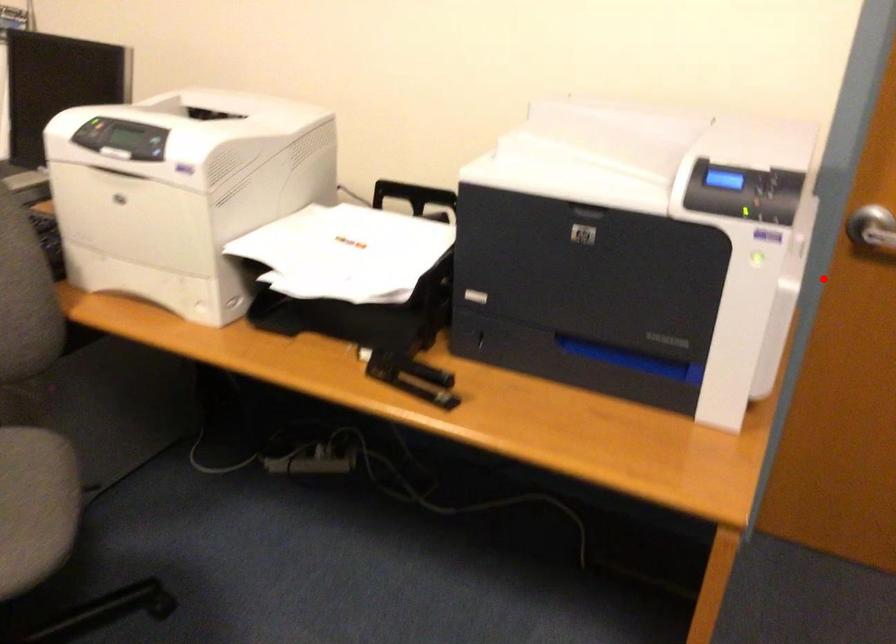
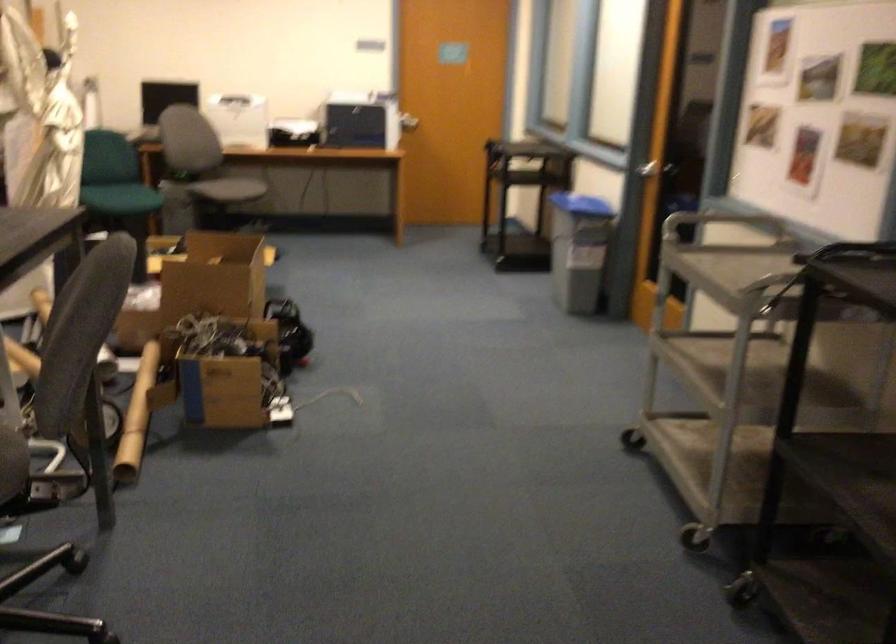
Question: A red point is marked in image1. In image2, is the corresponding 3D point closer to the camera or farther? Reply with the corresponding letter.

Choices:
 (A) The corresponding 3D point is closer.
 (B) The corresponding 3D point is farther.

Answer: (B)